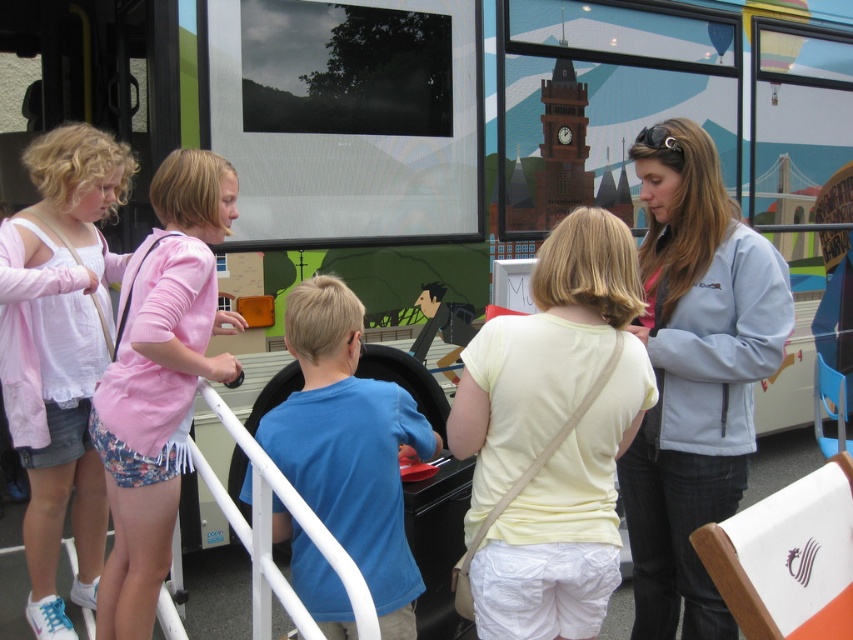
You are standing in front of the colorful mobile exhibit bus and see two points marked on its surface. The first point is at coordinate point (212, 304) and the second is at point (403, 445). If you want to touch both points starting from the closest one to you, which point should you touch first?

You should touch point (212, 304) first because it is closer to you than point (403, 445).